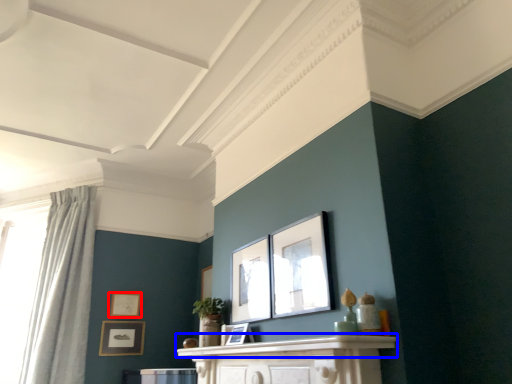
Question: Which of the following is the closest to the observer, picture frame (highlighted by a red box) or mantle (highlighted by a blue box)?

Choices:
 (A) picture frame
 (B) mantle

Answer: (B)